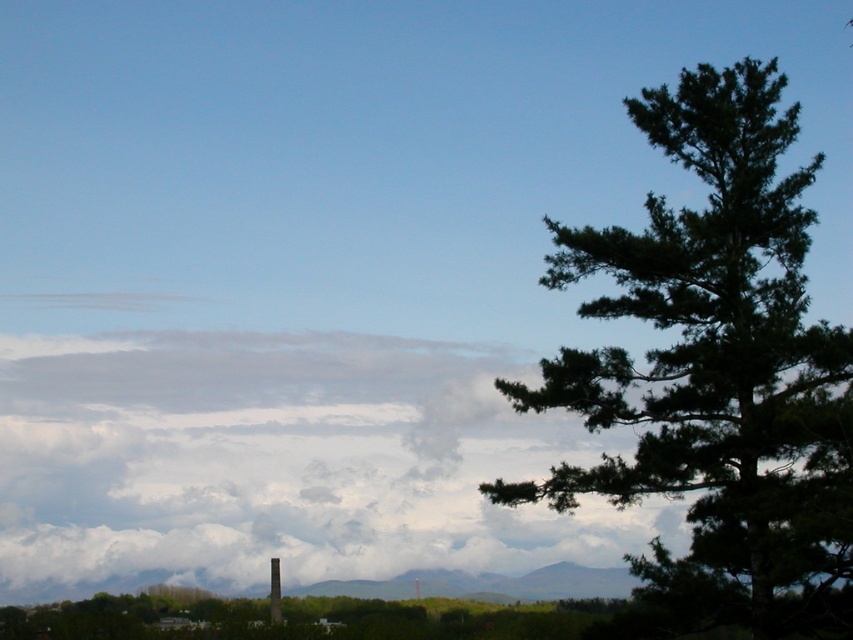
Question: Which point appears farthest from the camera in this image?

Choices:
 (A) (635, 477)
 (B) (193, 390)

Answer: (B)

Question: Can you confirm if cloudy white cloud at upper left is bigger than dark green pine tree at right?

Choices:
 (A) no
 (B) yes

Answer: (B)

Question: Does cloudy white cloud at upper left lie in front of dark green pine tree at right?

Choices:
 (A) yes
 (B) no

Answer: (B)

Question: Can you confirm if cloudy white cloud at upper left is positioned above dark green pine tree at right?

Choices:
 (A) yes
 (B) no

Answer: (B)